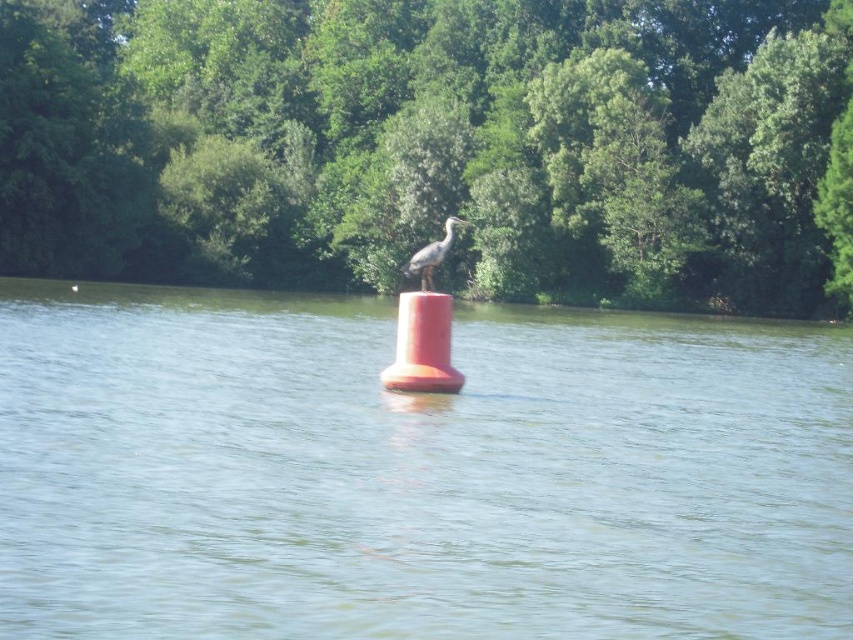
You are navigating a small boat and need to avoid hitting the orange buoy at center. Based on the coordinates provided, can you determine if the buoy is positioned closer to the left or right side of the water body?

The orange buoy at center is located at coordinates point (x=415, y=472), which places it closer to the right side of the water body since the x coordinate is higher than 0.5.

You are standing on the lakeshore and notice the orange buoy at center and the gray feathered bird at center. Which object is positioned to the right when looking at the scene?

The gray feathered bird at center is positioned to the right of the orange buoy at center.

You are standing at the edge of the water and want to walk to the point closer to you between point (793, 396) and point (445, 252). Which point should you head towards?

You should head towards point (445, 252) because it is closer to you than point (793, 396).